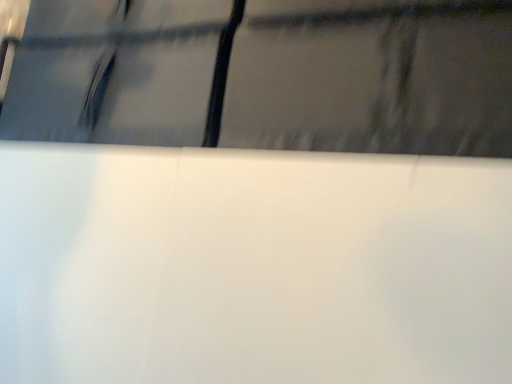
Question: Should I look upward or downward to see white glossy window at upper center?

Choices:
 (A) up
 (B) down

Answer: (A)